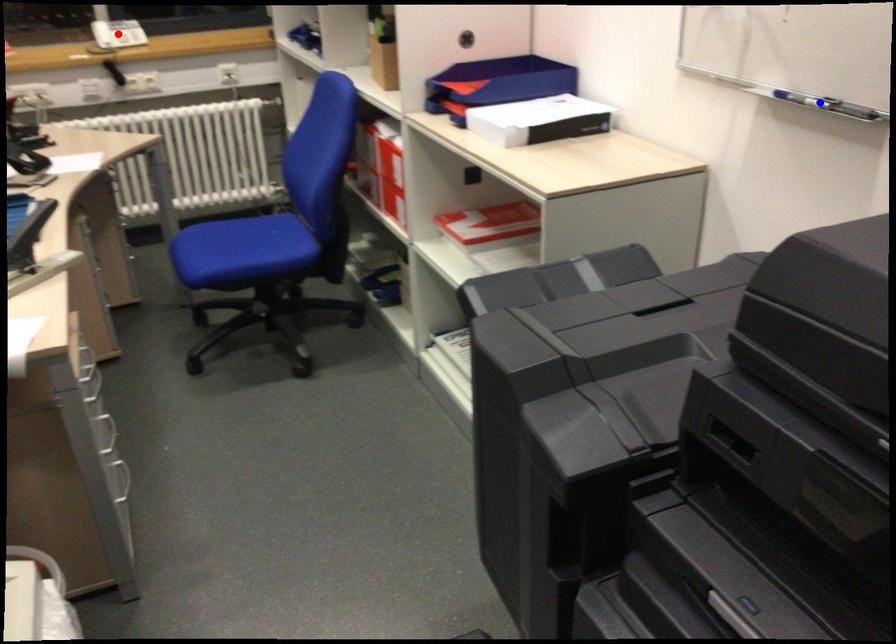
Question: Two points are marked on the image. Which point is closer to the camera?

Choices:
 (A) Blue point is closer.
 (B) Red point is closer.

Answer: (A)